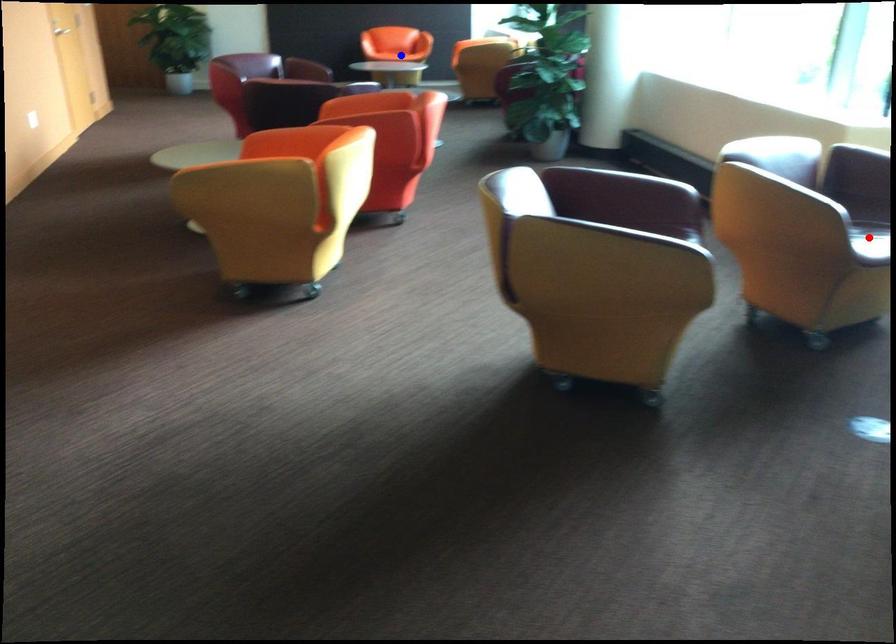
Question: In the image, two points are highlighted. Which point is nearer to the camera? Reply with the corresponding letter.

Choices:
 (A) blue point
 (B) red point

Answer: (B)